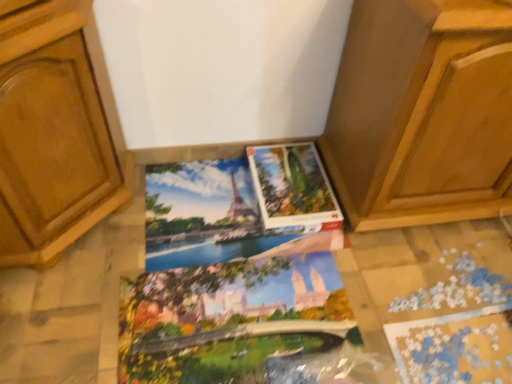
Identify the location of free space above matte paper coloring book at center, placed as the first coloring book when sorted from top to bottom (from a real-world perspective). The width and height of the screenshot is (512, 384). (209, 206).